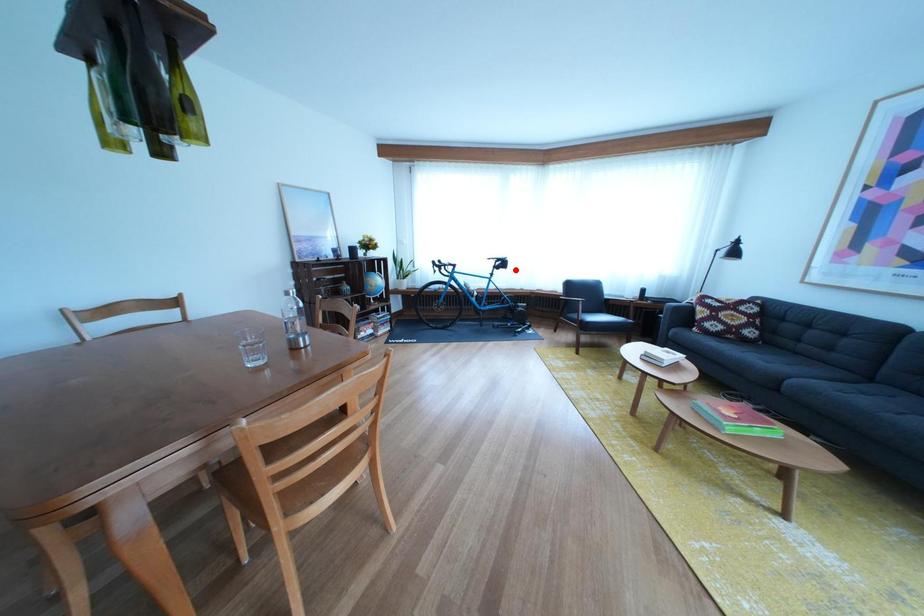
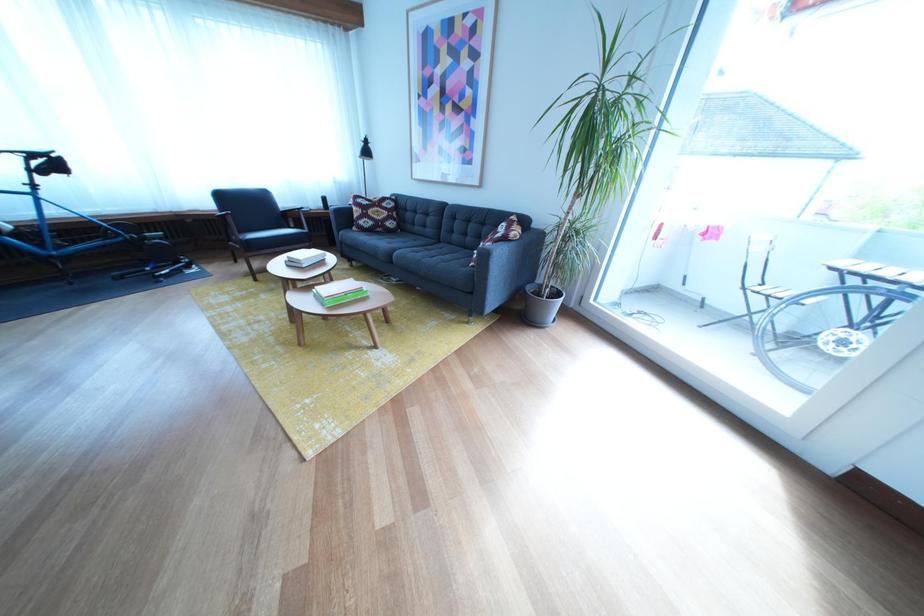
Where in the second image is the point corresponding to the highlighted location from the first image?

(64, 169)